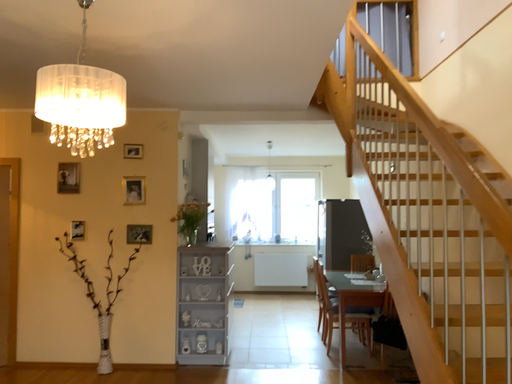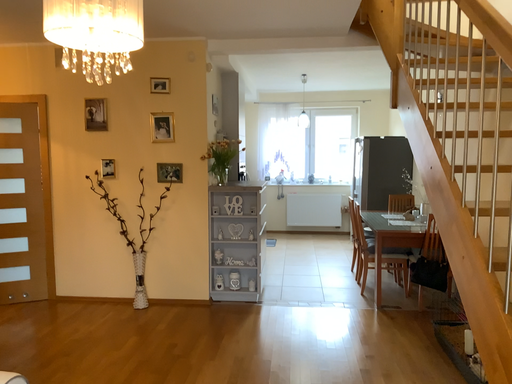
Question: How did the camera likely rotate when shooting the video?

Choices:
 (A) rotated upward
 (B) rotated downward

Answer: (B)